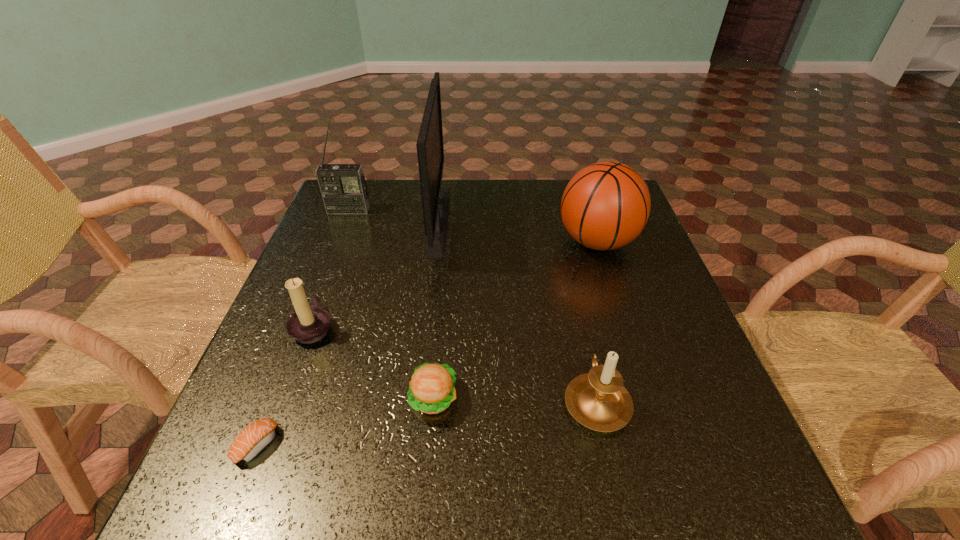
Find the location of a particular element. object that is positioned at the near edge is located at coordinates (256, 436).

Identify the location of radio receiver positioned at the left edge. (344, 191).

In order to click on candle holder present at the left edge in this screenshot , I will do `click(309, 324)`.

Locate an element on the screen. sushi that is at the left edge is located at coordinates (256, 436).

Locate an element on the screen. object present at the right edge is located at coordinates (606, 205).

Find the location of a particular element. Image resolution: width=960 pixels, height=540 pixels. object that is at the far left corner is located at coordinates (344, 191).

In order to click on object located in the near left corner section of the desktop in this screenshot , I will do `click(256, 436)`.

Locate an element on the screen. The image size is (960, 540). object present at the far right corner is located at coordinates (606, 205).

You are a GUI agent. You are given a task and a screenshot of the screen. Output one action in this format:
    pyautogui.click(x=<x>, y=<y>)
    Task: Click on the free space at the far edge of the desktop
    This screenshot has width=960, height=540.
    Given the screenshot: What is the action you would take?
    pyautogui.click(x=393, y=201)

Locate an element on the screen. The height and width of the screenshot is (540, 960). free spot at the near edge of the desktop is located at coordinates (468, 500).